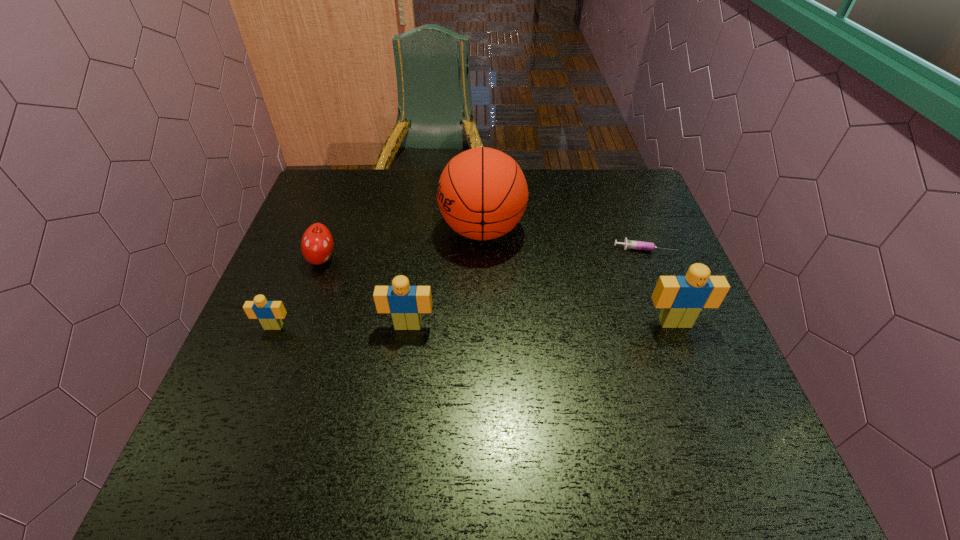
To achieve even spacing by inserting another Lego among them, please point to a vacant spot for this new Lego. Please provide its 2D coordinates. Your answer should be formatted as a tuple, i.e. [(x, y)], where the tuple contains the x and y coordinates of a point satisfying the conditions above.

[(541, 324)]